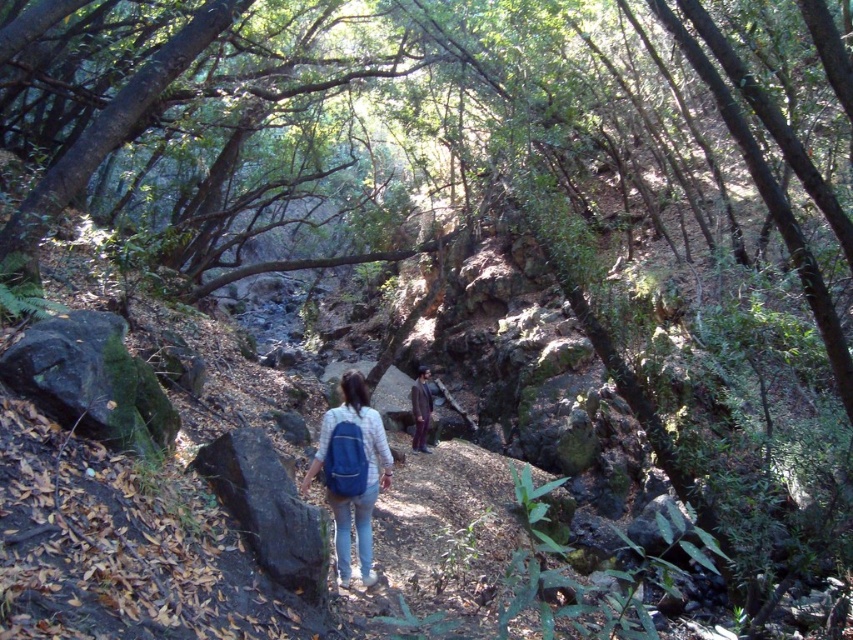
Is black rough rock at center further to camera compared to blue fabric backpack at center?

No, it is not.

From the picture: Does black rough rock at center have a greater width compared to blue fabric backpack at center?

Yes.

Is point (280, 518) less distant than point (347, 520)?

Yes, it is in front of point (347, 520).

Where is `black rough rock at center`? This screenshot has width=853, height=640. black rough rock at center is located at coordinates (268, 509).

Is black rough rock at center bigger than dark brown suit at center?

Incorrect, black rough rock at center is not larger than dark brown suit at center.

Between black rough rock at center and dark brown suit at center, which one appears on the right side from the viewer's perspective?

dark brown suit at center

Identify the location of black rough rock at center. This screenshot has height=640, width=853. (268, 509).

Does blue fabric backpack at center have a larger size compared to dark brown suit at center?

Result: No, blue fabric backpack at center is not bigger than dark brown suit at center.

Between blue fabric backpack at center and dark brown suit at center, which one is positioned higher?

Positioned higher is blue fabric backpack at center.

Identify the location of blue fabric backpack at center. (358, 476).

Locate an element on the screen. Image resolution: width=853 pixels, height=640 pixels. blue fabric backpack at center is located at coordinates (358, 476).